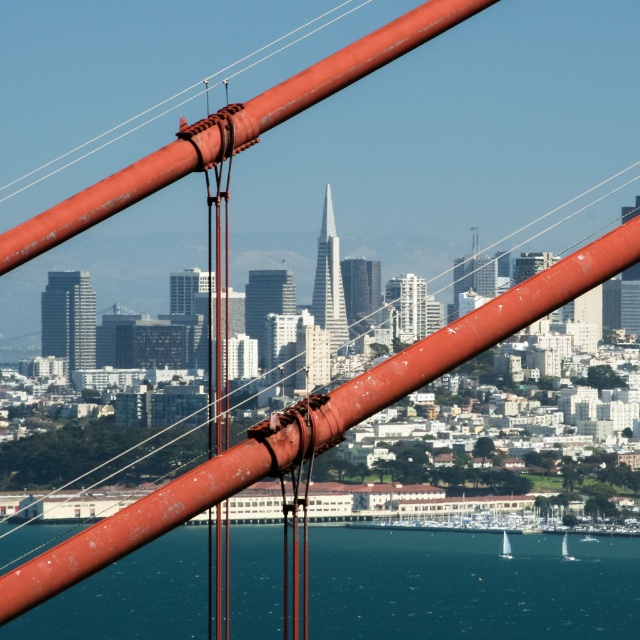
Does point (458, 614) come closer to viewer compared to point (509, 556)?

Yes, it is.

Can you confirm if blue water at lower center is shorter than white sailboat at lower center?

Incorrect, blue water at lower center's height does not fall short of white sailboat at lower center's.

Who is more forward, (68,624) or (506,536)?

Point (506,536) is in front.

Locate an element on the screen. The width and height of the screenshot is (640, 640). blue water at lower center is located at coordinates (468, 586).

Is blue water at lower center to the left of white glossy sailboat at lower right from the viewer's perspective?

Yes, blue water at lower center is to the left of white glossy sailboat at lower right.

Does blue water at lower center have a larger size compared to white glossy sailboat at lower right?

Yes.

Which is in front, point (253, 545) or point (566, 538)?

Point (253, 545)

At what (x,y) coordinates should I click in order to perform the action: click on blue water at lower center. Please return your answer as a coordinate pair (x, y). Looking at the image, I should click on (468, 586).

Is white sailboat at lower center positioned in front of white glossy sailboat at lower right?

Yes, white sailboat at lower center is in front of white glossy sailboat at lower right.

Does point (506, 538) come behind point (566, 545)?

That is False.

Is point (502, 536) behind point (570, 560)?

That is False.

Identify the location of white sailboat at lower center. Image resolution: width=640 pixels, height=640 pixels. (506, 547).